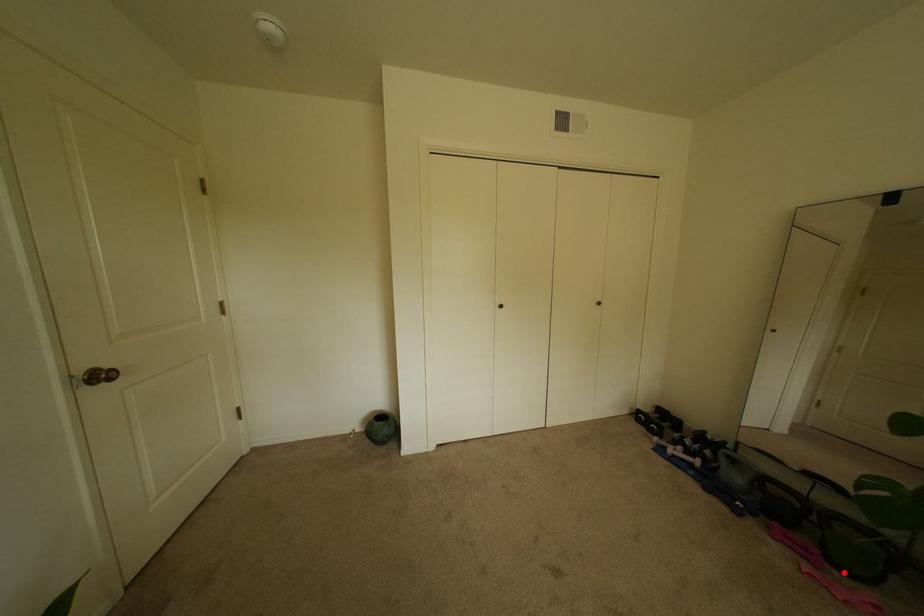
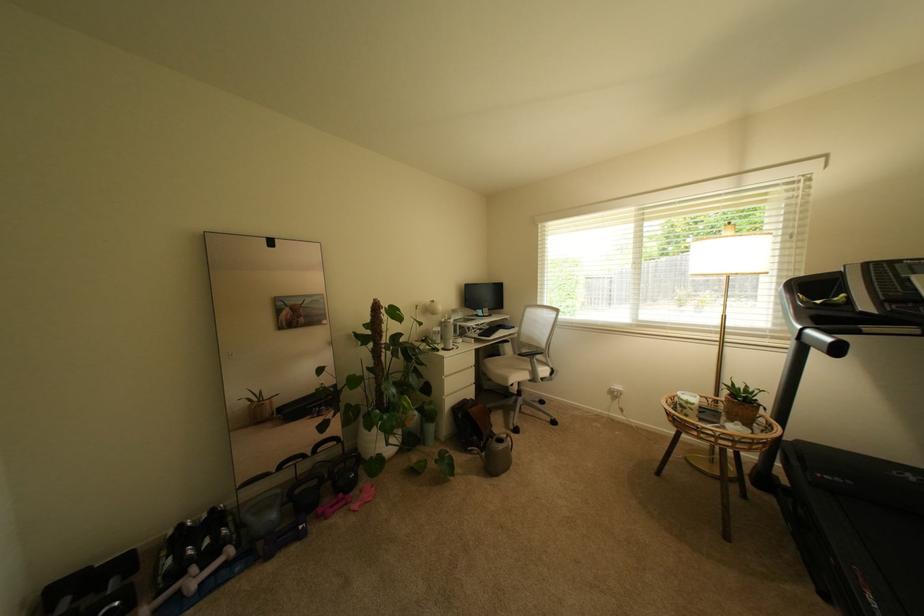
Question: I am providing you with two images of the same scene from different viewpoints. Image1 has a red point marked. In image2, the corresponding 3D location appears at what relative position? Reply with the corresponding letter.

Choices:
 (A) Closer
 (B) Farther

Answer: (B)